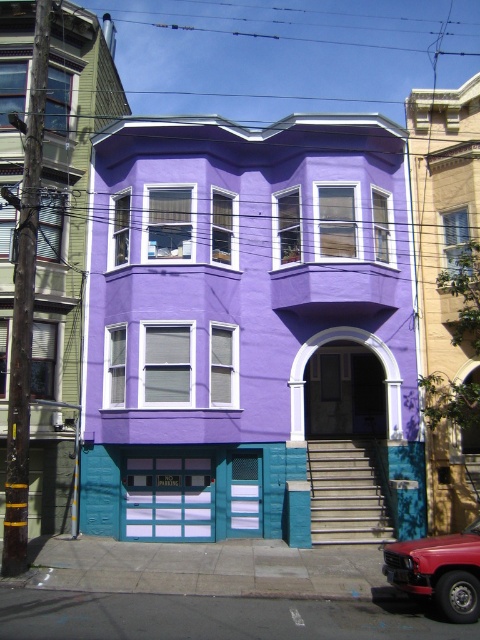
You are a delivery person trying to park your shiny red car at lower right near the matte blue garage door at lower center. Can you park the car close to the garage door without blocking the entrance? Explain your reasoning based on their sizes.

The matte blue garage door at lower center is smaller than the shiny red car at lower right. Since the garage door is smaller, there might not be enough space to park the car close to it without potentially blocking the entrance. It is advisable to park further away to avoid obstruction.

You are a delivery person trying to park your shiny red car at lower right near the matte blue garage door at lower center. Based on the scene description, can you safely park your car to the right of the garage door without blocking the entrance?

Yes, the matte blue garage door at lower center is to the left of the shiny red car at lower right, so parking the shiny red car at lower right to the right of the matte blue garage door at lower center would not block the entrance.

You are a delivery person trying to park your shiny red car at lower right near the matte blue garage door at lower center. Is there enough space between them for you to safely back into the parking spot?

The matte blue garage door at lower center is located below the shiny red car at lower right, which means the car is positioned above the garage door. Since the garage door is below, there is sufficient vertical space between them for the delivery person to safely back into the parking spot.